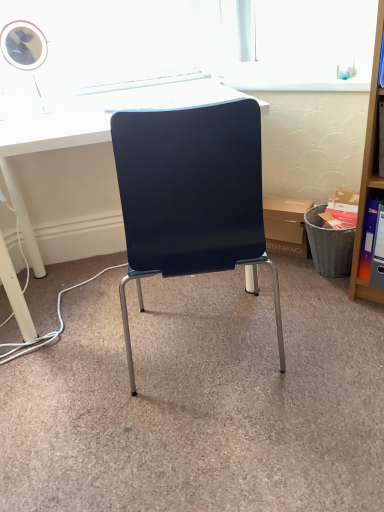
Question: Is point (367, 228) closer or farther from the camera than point (21, 117)?

Choices:
 (A) closer
 (B) farther

Answer: (A)

Question: In terms of size, does orange plastic ring binder at right appear bigger or smaller than white glossy desk at center?

Choices:
 (A) big
 (B) small

Answer: (B)

Question: Based on their relative distances, which object is farther from the wooden shelf at right?

Choices:
 (A) orange plastic ring binder at right
 (B) white glossy desk at center
 (C) matte cardboard box at center

Answer: (B)

Question: Which object is positioned closest to the white glossy desk at center?

Choices:
 (A) wooden shelf at right
 (B) orange plastic ring binder at right
 (C) matte cardboard box at center

Answer: (C)